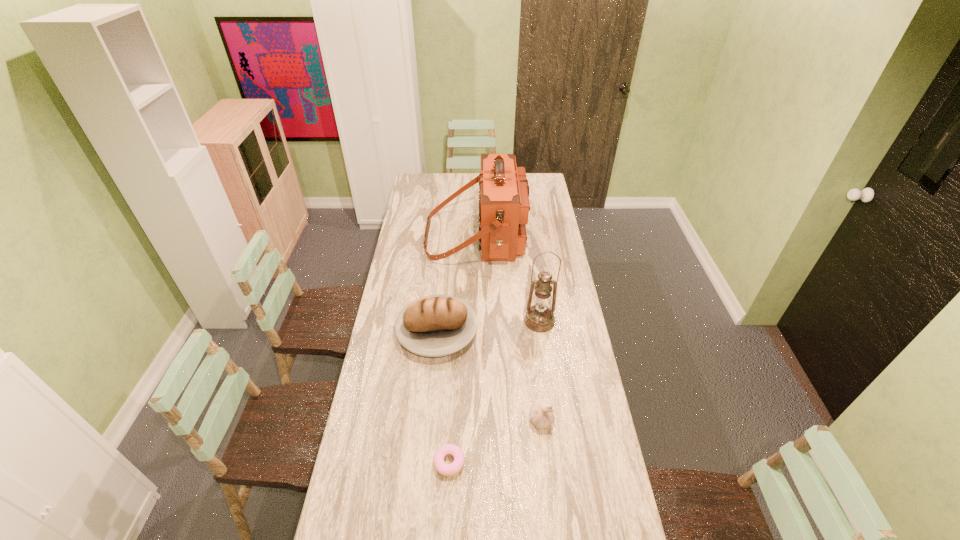
Find the location of a particular element. The height and width of the screenshot is (540, 960). vacant space located 0.390m on the left of the second shortest object is located at coordinates (418, 421).

The image size is (960, 540). Identify the location of vacant space located on the right of the doughnut. (523, 462).

Identify the location of satchel located in the left edge section of the desktop. (504, 206).

Find the location of `bread that is at the left edge`. bread that is at the left edge is located at coordinates (438, 325).

The width and height of the screenshot is (960, 540). In order to click on object that is at the right edge in this screenshot , I will do click(x=539, y=318).

What are the coordinates of `vacant space at the far edge` in the screenshot? It's located at (461, 177).

Image resolution: width=960 pixels, height=540 pixels. Identify the location of blank area at the left edge. (417, 225).

This screenshot has width=960, height=540. In order to click on free space at the right edge in this screenshot , I will do `click(570, 303)`.

Locate an element on the screen. This screenshot has height=540, width=960. free space at the far left corner is located at coordinates (438, 184).

The width and height of the screenshot is (960, 540). Find the location of `free space between the oil lamp and the bread`. free space between the oil lamp and the bread is located at coordinates (489, 326).